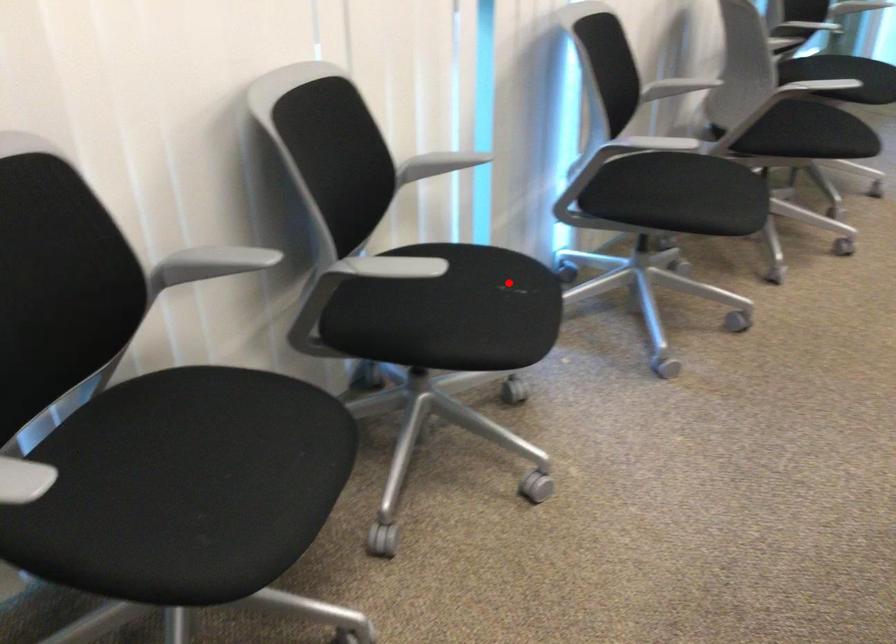
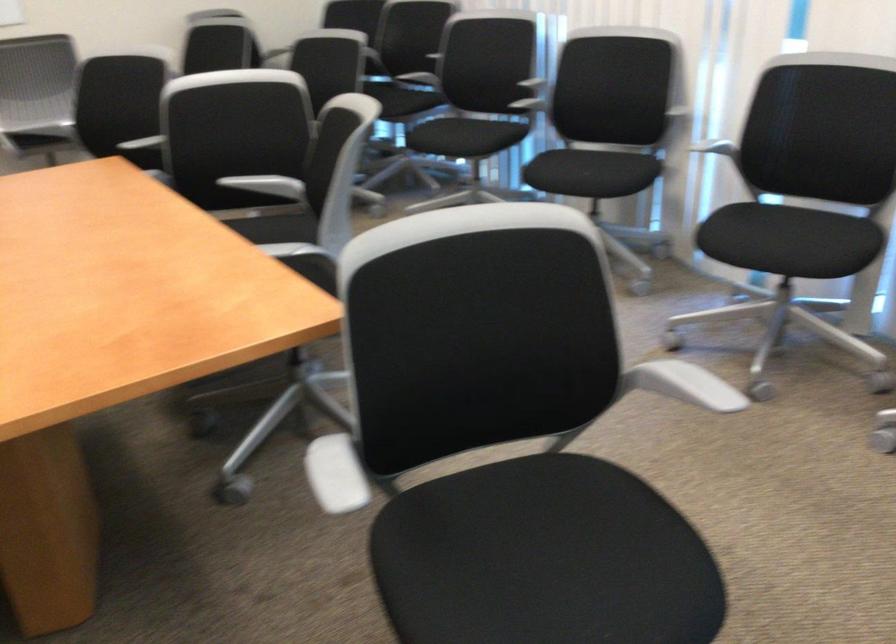
Where in the second image is the point corresponding to the highlighted location from the first image?

(587, 174)